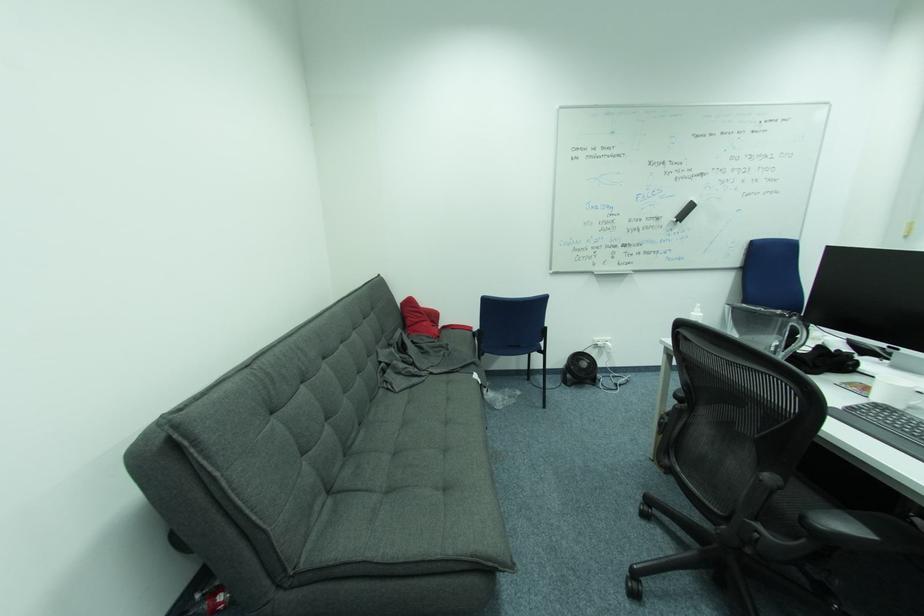
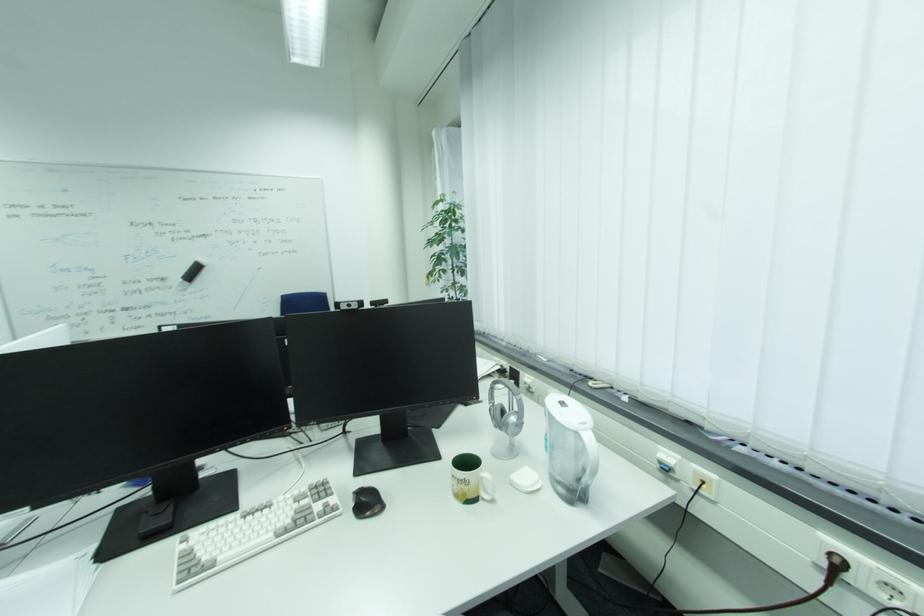
The point at [684,217] is marked in the first image. Where is the corresponding point in the second image?

(189, 278)